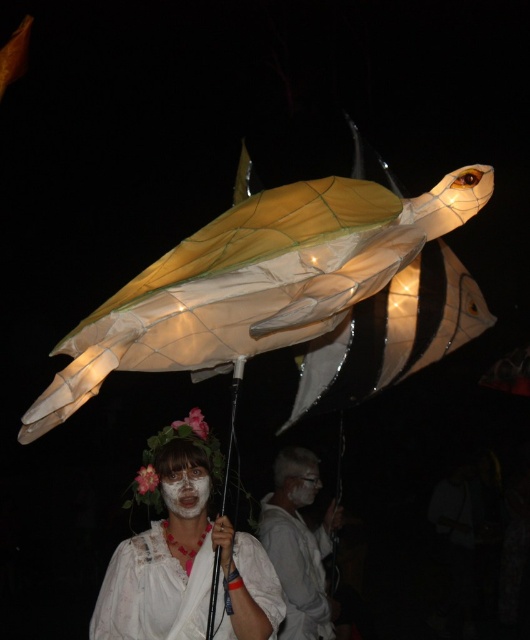
Question: Is white lace dress at center thinner than white matte/porcelain mask at center?

Choices:
 (A) no
 (B) yes

Answer: (A)

Question: Where is white matte/porcelain mask at center located in relation to matte white face at center in the image?

Choices:
 (A) left
 (B) right

Answer: (A)

Question: Which object appears farthest from the camera in this image?

Choices:
 (A) white matte face mask at center
 (B) white matte/porcelain mask at center

Answer: (B)

Question: Among these objects, which one is nearest to the camera?

Choices:
 (A) white lace dress at center
 (B) matte white face at center
 (C) white matte/porcelain mask at center
 (D) white matte face mask at center

Answer: (A)

Question: From the image, what is the correct spatial relationship of white matte/porcelain mask at center in relation to matte white face at center?

Choices:
 (A) right
 (B) left

Answer: (B)

Question: Which point is farther to the camera?

Choices:
 (A) (172, 632)
 (B) (313, 490)

Answer: (B)